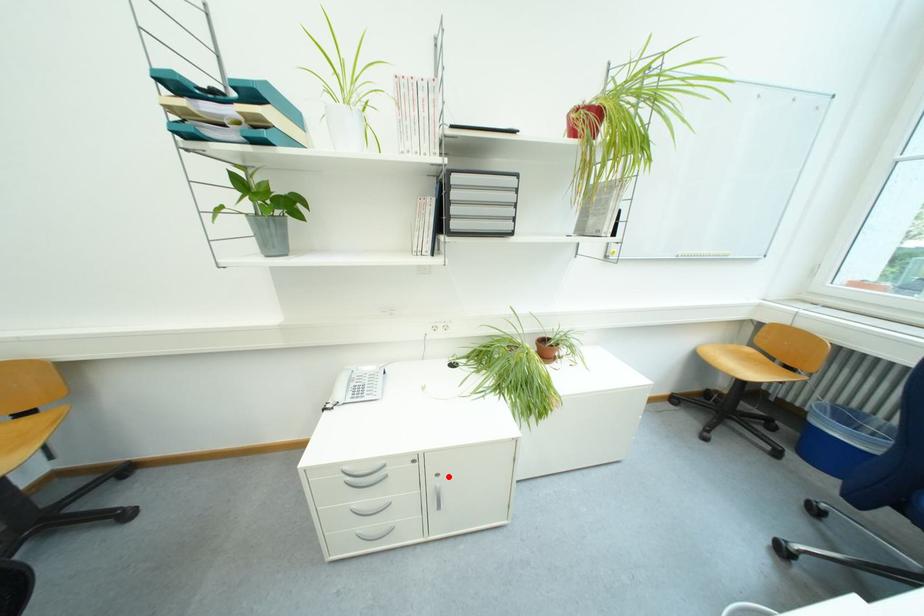
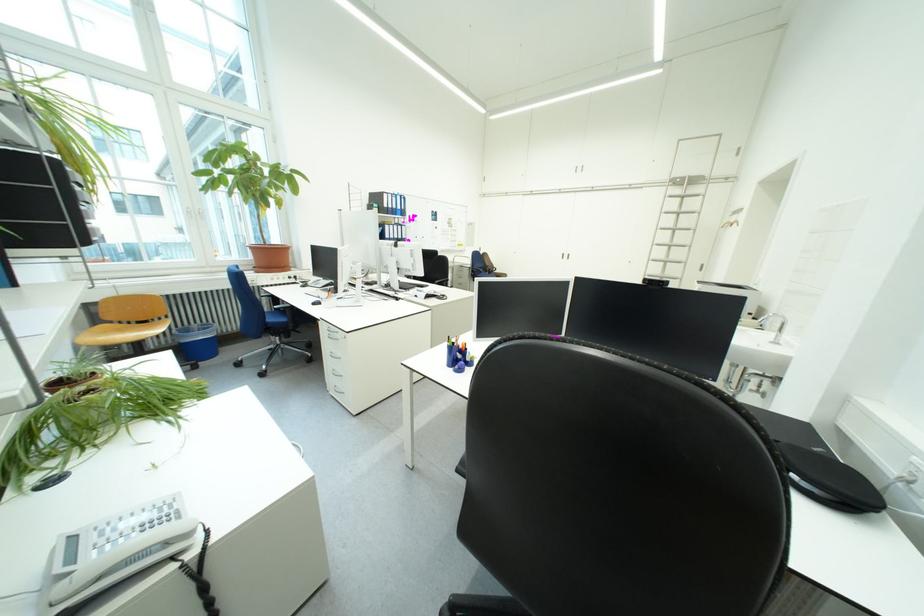
Question: I am providing you with two images of the same scene from different viewpoints. A red point is marked on the first image. Is the red point's position out of view in image 2?

Choices:
 (A) Yes
 (B) No

Answer: (A)